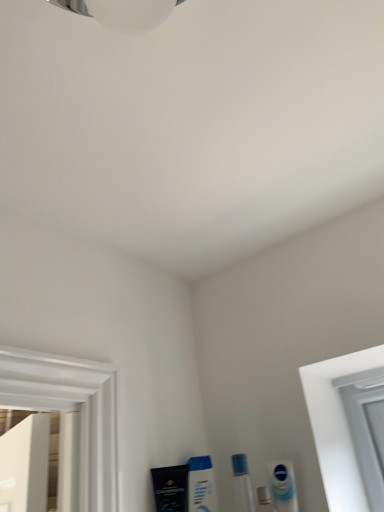
Question: Is white glossy tube at lower right, which is the fourth mouthwash from left to right, to the right of black matte tube at lower left, positioned as the fourth mouthwash in right-to-left order, from the viewer's perspective?

Choices:
 (A) yes
 (B) no

Answer: (A)

Question: Does white glossy tube at lower right, which is the fourth mouthwash from left to right, turn towards black matte tube at lower left, acting as the first mouthwash starting from the left?

Choices:
 (A) no
 (B) yes

Answer: (A)

Question: Considering the relative positions of white glossy tube at lower right, which is the first mouthwash in right-to-left order, and black matte tube at lower left, acting as the first mouthwash starting from the left, in the image provided, is white glossy tube at lower right, which is the first mouthwash in right-to-left order, to the left of black matte tube at lower left, acting as the first mouthwash starting from the left, from the viewer's perspective?

Choices:
 (A) yes
 (B) no

Answer: (B)

Question: Can you confirm if white glossy tube at lower right, which is the fourth mouthwash from left to right, is taller than black matte tube at lower left, positioned as the fourth mouthwash in right-to-left order?

Choices:
 (A) yes
 (B) no

Answer: (B)

Question: Is white glossy tube at lower right, which is the first mouthwash in right-to-left order, positioned far away from black matte tube at lower left, acting as the first mouthwash starting from the left?

Choices:
 (A) no
 (B) yes

Answer: (A)

Question: Considering the positions of transparent plastic vial at lower center and white glossy mouthwash at lower center, the third mouthwash viewed from the right, in the image, is transparent plastic vial at lower center taller or shorter than white glossy mouthwash at lower center, the third mouthwash viewed from the right,?

Choices:
 (A) tall
 (B) short

Answer: (B)

Question: Is transparent plastic vial at lower center wider or thinner than white glossy mouthwash at lower center, the second mouthwash in the left-to-right sequence?

Choices:
 (A) wide
 (B) thin

Answer: (A)

Question: Does point (243, 501) appear closer or farther from the camera than point (215, 507)?

Choices:
 (A) closer
 (B) farther

Answer: (A)

Question: Based on their sizes in the image, would you say transparent plastic vial at lower center is bigger or smaller than white glossy mouthwash at lower center, the second mouthwash in the left-to-right sequence?

Choices:
 (A) big
 (B) small

Answer: (B)

Question: Would you say silver metallic mouthwash at lower center, the second mouthwash viewed from the right, is to the left or to the right of white glossy mouthwash at lower center, the second mouthwash in the left-to-right sequence, in the picture?

Choices:
 (A) right
 (B) left

Answer: (A)

Question: Is silver metallic mouthwash at lower center, the second mouthwash viewed from the right, inside the boundaries of white glossy mouthwash at lower center, the second mouthwash in the left-to-right sequence, or outside?

Choices:
 (A) outside
 (B) inside

Answer: (A)

Question: From a real-world perspective, relative to white glossy mouthwash at lower center, the third mouthwash viewed from the right, is silver metallic mouthwash at lower center, placed as the 3th mouthwash when sorted from left to right, vertically above or below?

Choices:
 (A) above
 (B) below

Answer: (B)

Question: In terms of height, does silver metallic mouthwash at lower center, the second mouthwash viewed from the right, look taller or shorter compared to white glossy mouthwash at lower center, the second mouthwash in the left-to-right sequence?

Choices:
 (A) tall
 (B) short

Answer: (B)

Question: From a real-world perspective, is white glossy mouthwash at lower center, the third mouthwash viewed from the right, positioned above or below transparent plastic vial at lower center?

Choices:
 (A) above
 (B) below

Answer: (A)

Question: In terms of width, does white glossy mouthwash at lower center, the second mouthwash in the left-to-right sequence, look wider or thinner when compared to transparent plastic vial at lower center?

Choices:
 (A) wide
 (B) thin

Answer: (B)